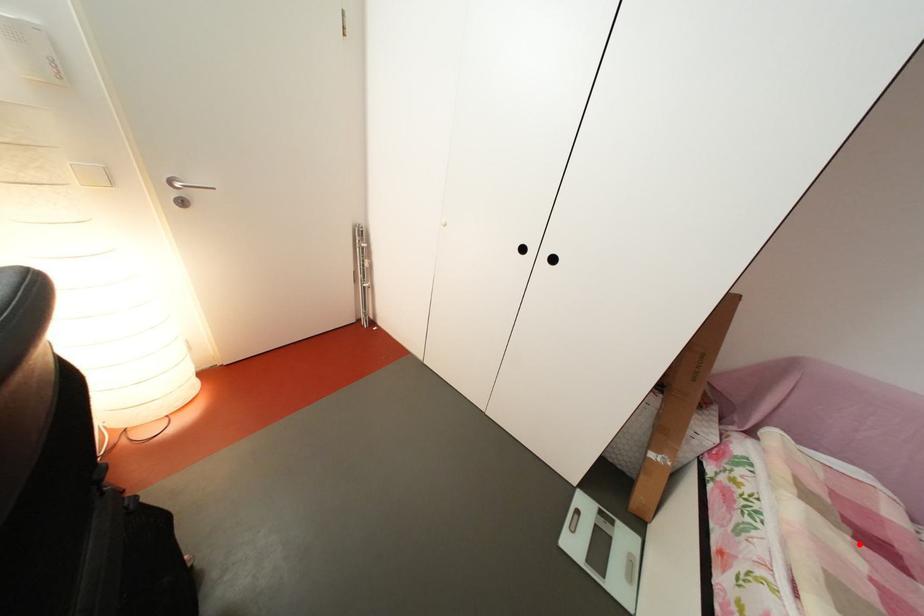
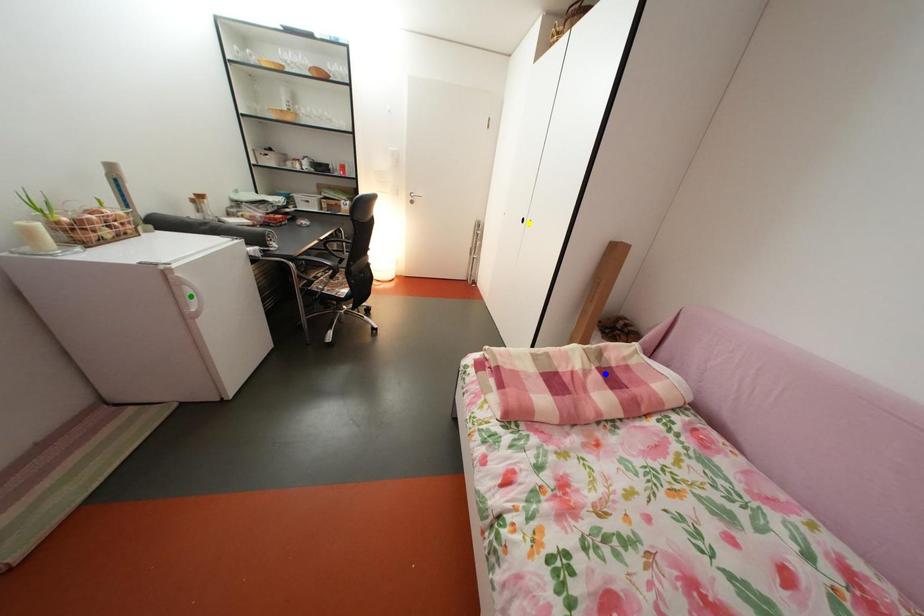
Question: I am providing you with two images of the same scene from different viewpoints. A red point is marked on the first image. You are given multiple points on the second image. Which mark in image 2 goes with the point in image 1?

Choices:
 (A) blue point
 (B) green point
 (C) yellow point

Answer: (A)